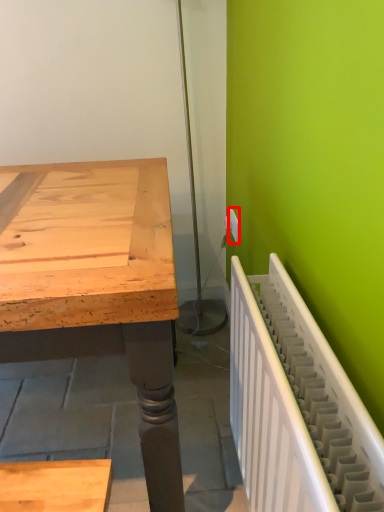
Question: From the image's perspective, considering the relative positions of electric outlet (annotated by the red box) and radiator in the image provided, where is electric outlet (annotated by the red box) located with respect to the staircase?

Choices:
 (A) above
 (B) below

Answer: (A)